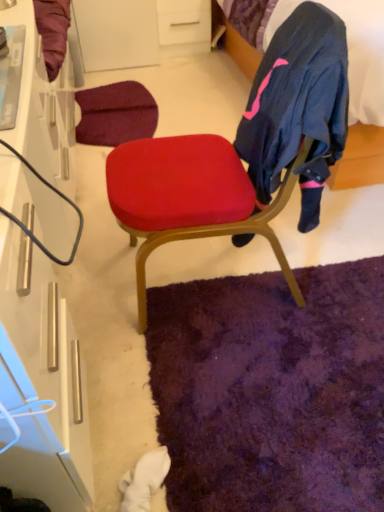
The height and width of the screenshot is (512, 384). I want to click on matte red cushion at center, so click(244, 153).

From the picture: In order to face matte red cushion at center, should I rotate leftwards or rightwards?

To align with it, rotate right about 2.680°.

You are a GUI agent. You are given a task and a screenshot of the screen. Output one action in this format:
    pyautogui.click(x=<x>, y=<y>)
    Task: Click on the velvet dark blue bed at upper right
    The height and width of the screenshot is (512, 384).
    Given the screenshot: What is the action you would take?
    pyautogui.click(x=360, y=159)

Could velvet dark blue bed at upper right be considered to be inside white matte drawer at upper center?

No.

Locate an element on the screen. The height and width of the screenshot is (512, 384). bed located in front of the white matte drawer at upper center is located at coordinates (360, 159).

How different are the orientations of white matte drawer at upper center and velvet dark blue bed at upper right in degrees?

They differ by 1.82 degrees in their facing directions.

Consider the image. Which is more to the right, white matte drawer at upper center or velvet dark blue bed at upper right?

velvet dark blue bed at upper right is more to the right.

Does matte red cushion at center have a lesser height compared to velvet dark blue bed at upper right?

Incorrect, the height of matte red cushion at center does not fall short of that of velvet dark blue bed at upper right.

Does matte red cushion at center have a smaller size compared to velvet dark blue bed at upper right?

Indeed, matte red cushion at center has a smaller size compared to velvet dark blue bed at upper right.

From the image's perspective, is matte red cushion at center beneath velvet dark blue bed at upper right?

Yes, from the image's perspective, matte red cushion at center is beneath velvet dark blue bed at upper right.

Consider the image. From a real-world perspective, is matte red cushion at center above or below velvet dark blue bed at upper right?

matte red cushion at center is situated higher than velvet dark blue bed at upper right in the real world.

Who is shorter, matte red cushion at center or white matte drawer at upper center?

With less height is white matte drawer at upper center.

Would you consider matte red cushion at center to be distant from white matte drawer at upper center?

Yes, matte red cushion at center and white matte drawer at upper center are quite far apart.

Relative to white matte drawer at upper center, is matte red cushion at center in front or behind?

Visually, matte red cushion at center is located in front of white matte drawer at upper center.

Which object is thinner, matte red cushion at center or white matte drawer at upper center?

white matte drawer at upper center.

The width and height of the screenshot is (384, 512). I want to click on cabinetry that is above the purple shaggy rug at lower center (from the image's perspective), so click(x=42, y=380).

Are purple shaggy rug at lower center and white glossy cabinet at left making contact?

No.

Is purple shaggy rug at lower center thinner than white glossy cabinet at left?

No.

Considering their positions, is purple shaggy rug at lower center located in front of or behind white glossy cabinet at left?

purple shaggy rug at lower center is behind white glossy cabinet at left.

Can you confirm if velvet dark blue bed at upper right is wider than white glossy cabinet at left?

Correct, the width of velvet dark blue bed at upper right exceeds that of white glossy cabinet at left.

Does point (341, 182) come in front of point (61, 324)?

No, (341, 182) is further to viewer.

Looking at the image, does velvet dark blue bed at upper right seem bigger or smaller compared to white glossy cabinet at left?

Considering their sizes, velvet dark blue bed at upper right takes up more space than white glossy cabinet at left.

From the image's perspective, between velvet dark blue bed at upper right and white glossy cabinet at left, who is located below?

white glossy cabinet at left appears lower in the image.

Can you tell me how much white glossy cabinet at left and purple shaggy rug at lower center differ in facing direction?

The angular difference between white glossy cabinet at left and purple shaggy rug at lower center is 89.7 degrees.

Is purple shaggy rug at lower center surrounded by white glossy cabinet at left?

Definitely not — purple shaggy rug at lower center is not inside white glossy cabinet at left.

Between white glossy cabinet at left and purple shaggy rug at lower center, which one has less height?

purple shaggy rug at lower center is shorter.

Considering the positions of objects white glossy cabinet at left and purple shaggy rug at lower center in the image provided, who is more to the right, white glossy cabinet at left or purple shaggy rug at lower center?

purple shaggy rug at lower center.

Find the location of a particular element. The image size is (384, 512). cabinetry in front of the velvet dark blue bed at upper right is located at coordinates (42, 380).

Is white glossy cabinet at left facing towards velvet dark blue bed at upper right?

Yes, white glossy cabinet at left is oriented towards velvet dark blue bed at upper right.

In the image, is white glossy cabinet at left on the left side or the right side of velvet dark blue bed at upper right?

From the image, it's evident that white glossy cabinet at left is to the left of velvet dark blue bed at upper right.

Considering the positions of points (40, 182) and (212, 16), is point (40, 182) closer to camera compared to point (212, 16)?

Yes, point (40, 182) is closer to viewer.

The width and height of the screenshot is (384, 512). In order to click on drawer on the left side of velvet dark blue bed at upper right in this screenshot , I will do `click(184, 21)`.

I want to click on chair that appears below the velvet dark blue bed at upper right (from the image's perspective), so coord(244,153).

Which object lies nearer to the anchor point matte red cushion at center, purple shaggy rug at lower center or velvet dark blue bed at upper right?

The object closer to matte red cushion at center is purple shaggy rug at lower center.

Based on the photo, from the image, which object appears to be nearer to white glossy cabinet at left, white matte drawer at upper center or matte red cushion at center?

matte red cushion at center is positioned closer to the anchor white glossy cabinet at left.

Which object lies nearer to the anchor point velvet dark blue bed at upper right, white glossy cabinet at left or white matte drawer at upper center?

Based on the image, white matte drawer at upper center appears to be nearer to velvet dark blue bed at upper right.

Looking at the image, which one is located further to velvet dark blue bed at upper right, matte red cushion at center or white matte drawer at upper center?

matte red cushion at center lies further to velvet dark blue bed at upper right than the other object.

Estimate the real-world distances between objects in this image. Which object is closer to purple shaggy rug at lower center, white matte drawer at upper center or velvet dark blue bed at upper right?

Based on the image, velvet dark blue bed at upper right appears to be nearer to purple shaggy rug at lower center.

Looking at the image, which one is located further to white matte drawer at upper center, purple shaggy rug at lower center or velvet dark blue bed at upper right?

Among the two, purple shaggy rug at lower center is located further to white matte drawer at upper center.

Considering their positions, is purple shaggy rug at lower center positioned further to matte red cushion at center than white matte drawer at upper center?

white matte drawer at upper center.

Which object lies further to the anchor point white glossy cabinet at left, velvet dark blue bed at upper right or white matte drawer at upper center?

white matte drawer at upper center is positioned further to the anchor white glossy cabinet at left.

The height and width of the screenshot is (512, 384). What are the coordinates of `bed between matte red cushion at center and white matte drawer at upper center in the front-back direction` in the screenshot? It's located at (360, 159).

You are a GUI agent. You are given a task and a screenshot of the screen. Output one action in this format:
    pyautogui.click(x=<x>, y=<y>)
    Task: Click on the bed between white glossy cabinet at left and white matte drawer at upper center from front to back
    This screenshot has width=384, height=512.
    Given the screenshot: What is the action you would take?
    pyautogui.click(x=360, y=159)

Locate an element on the screen. bed between white matte drawer at upper center and purple shaggy rug at lower center in the up-down direction is located at coordinates (360, 159).

The height and width of the screenshot is (512, 384). Find the location of `chair between white glossy cabinet at left and white matte drawer at upper center along the z-axis`. chair between white glossy cabinet at left and white matte drawer at upper center along the z-axis is located at coordinates (244, 153).